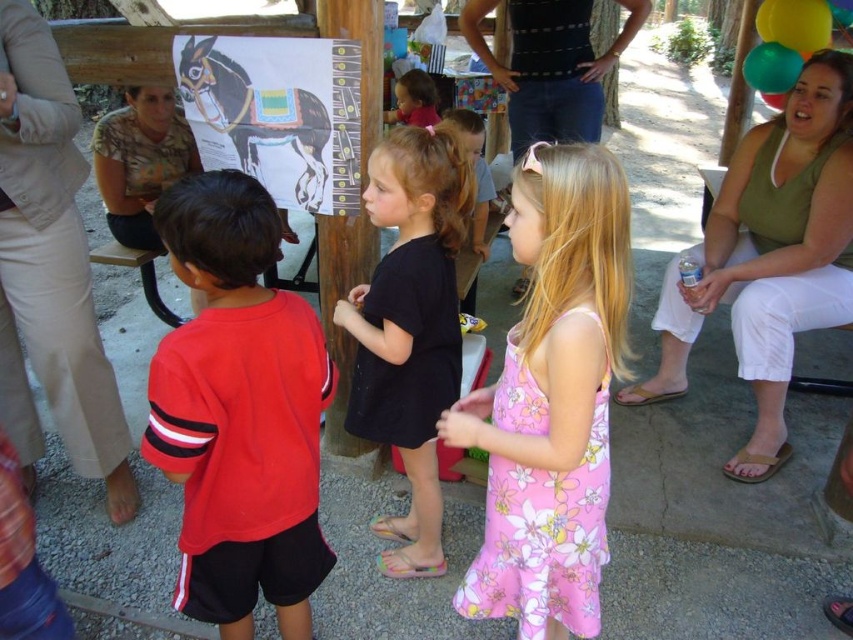
Question: Among these objects, which one is nearest to the camera?

Choices:
 (A) matte pink dress at center
 (B) translucent green balloon at upper right
 (C) green matte balloon at upper right

Answer: (C)

Question: Where is pink floral dress at center located in relation to green matte balloon at upper right in the image?

Choices:
 (A) below
 (B) above

Answer: (A)

Question: Among these points, which one is nearest to the camera?

Choices:
 (A) (827, 40)
 (B) (776, 88)
 (C) (376, 362)

Answer: (C)

Question: Does pink floral dress at center appear on the right side of matte pink dress at center?

Choices:
 (A) no
 (B) yes

Answer: (B)

Question: Which point is closer to the camera?

Choices:
 (A) (791, 61)
 (B) (755, 48)
 (C) (791, 3)

Answer: (C)

Question: Does yellow rubber balloon at upper right appear under translucent green balloon at upper right?

Choices:
 (A) no
 (B) yes

Answer: (A)